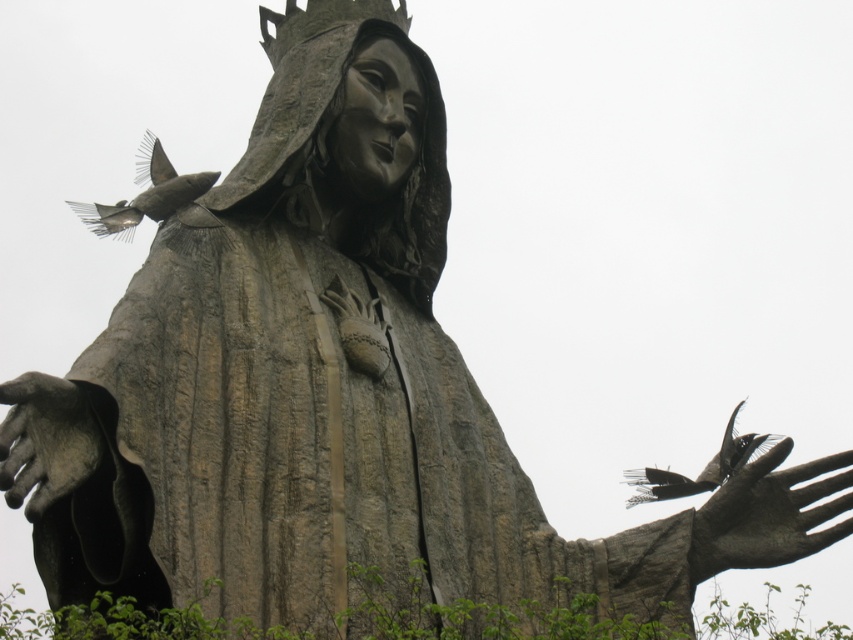
Question: Among these objects, which one is farthest from the camera?

Choices:
 (A) gray stone hand at right
 (B) stone textured hand at lower left
 (C) gray matte bird at upper left
 (D) dark gray feathers at right

Answer: (D)

Question: Does gray stone hand at right have a smaller size compared to gray matte bird at upper left?

Choices:
 (A) no
 (B) yes

Answer: (B)

Question: Which of these objects is positioned farthest from the dark gray feathers at right?

Choices:
 (A) stone textured hand at lower left
 (B) gray matte bird at upper left
 (C) gray stone hand at right

Answer: (A)

Question: Among these objects, which one is nearest to the camera?

Choices:
 (A) dark gray feathers at right
 (B) gray matte bird at upper left

Answer: (B)

Question: Does stone textured hand at lower left have a lesser width compared to gray matte bird at upper left?

Choices:
 (A) no
 (B) yes

Answer: (B)

Question: From the image, what is the correct spatial relationship of gray stone hand at right in relation to gray matte bird at upper left?

Choices:
 (A) above
 (B) below

Answer: (B)